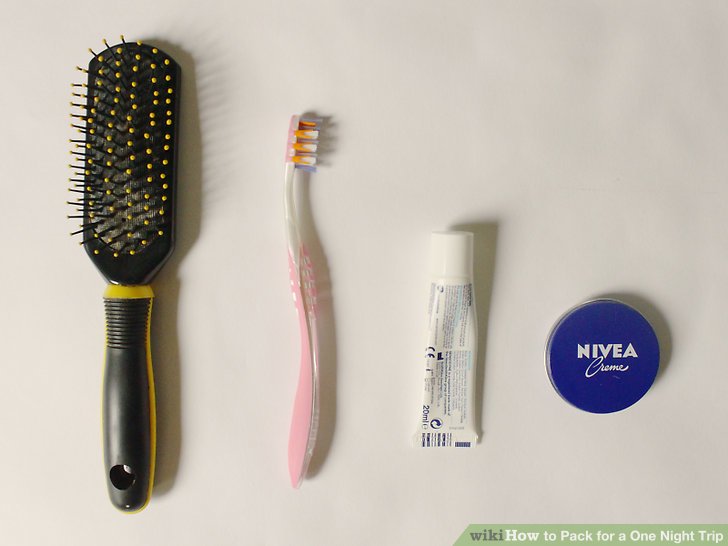
Locate an element on the screen. hair brush is located at coordinates click(127, 362).